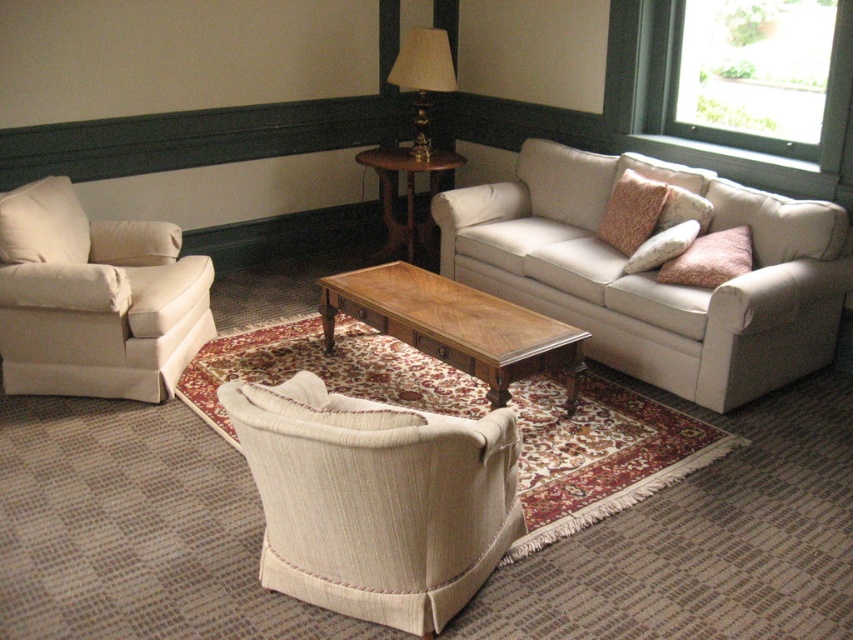
Question: From the image, what is the correct spatial relationship of wooden coffee table at center in relation to velvet pink pillow at center right?

Choices:
 (A) left
 (B) right

Answer: (A)

Question: Observing the image, what is the correct spatial positioning of transparent glass window at upper right in reference to white fabric pillow at left?

Choices:
 (A) below
 (B) above

Answer: (B)

Question: Estimate the real-world distances between objects in this image. Which object is farther from the gold metallic lamp at upper center?

Choices:
 (A) textured beige pillow at right
 (B) beige fabric couch at center

Answer: (A)

Question: Which point is closer to the camera?

Choices:
 (A) velvet pink pillow at right
 (B) beige fabric couch at center

Answer: (B)

Question: Estimate the real-world distances between objects in this image. Which object is farther from the velvet pink pillow at center right?

Choices:
 (A) gold metallic lamp at upper center
 (B) beige fabric armchair at left
 (C) velvet pink pillow at right
 (D) mahogany wood side table at center

Answer: (B)

Question: Is white fabric pillow at left to the left of textured beige pillow at right from the viewer's perspective?

Choices:
 (A) no
 (B) yes

Answer: (B)